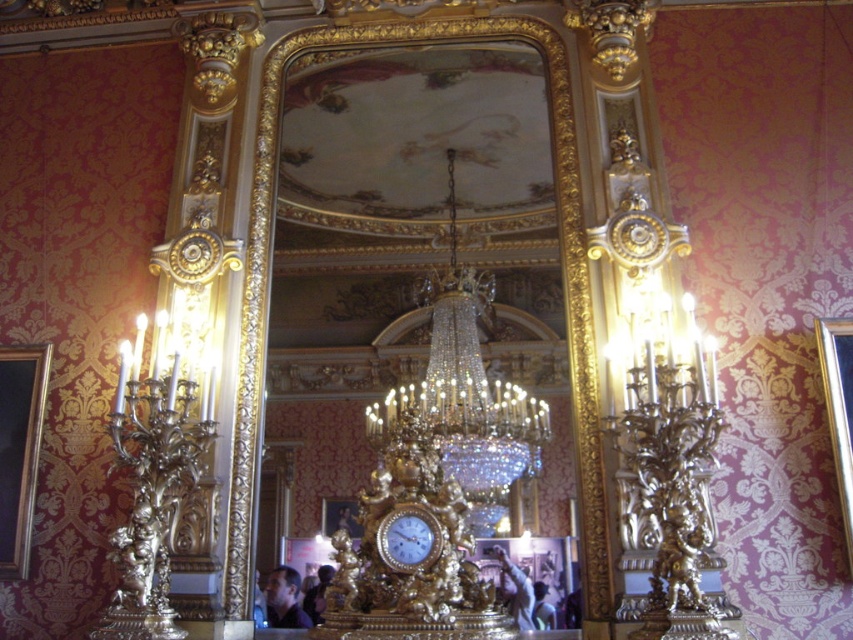
Is smooth skin face at center below gold textured frame at center?

Yes, smooth skin face at center is below gold textured frame at center.

Which is more to the right, smooth skin face at center or gold textured frame at center?

From the viewer's perspective, gold textured frame at center appears more on the right side.

Find the location of a particular element. smooth skin face at center is located at coordinates (283, 600).

Where is `smooth skin face at center`? The height and width of the screenshot is (640, 853). smooth skin face at center is located at coordinates (283, 600).

Between wooden picture frame at left and dark blue fabric at center, which one is positioned higher?

wooden picture frame at left is higher up.

Can you confirm if wooden picture frame at left is thinner than dark blue fabric at center?

Indeed, wooden picture frame at left has a lesser width compared to dark blue fabric at center.

Does point (28, 387) come farther from viewer compared to point (514, 602)?

No, (28, 387) is in front of (514, 602).

Where is `wooden picture frame at left`? The width and height of the screenshot is (853, 640). wooden picture frame at left is located at coordinates (19, 449).

Which is behind, point (16, 365) or point (836, 349)?

Positioned behind is point (16, 365).

Between wooden picture frame at left and gold textured picture frame at right, which one appears on the left side from the viewer's perspective?

wooden picture frame at left

The width and height of the screenshot is (853, 640). What do you see at coordinates (19, 449) in the screenshot?
I see `wooden picture frame at left` at bounding box center [19, 449].

Where is `wooden picture frame at left`? The image size is (853, 640). wooden picture frame at left is located at coordinates 19,449.